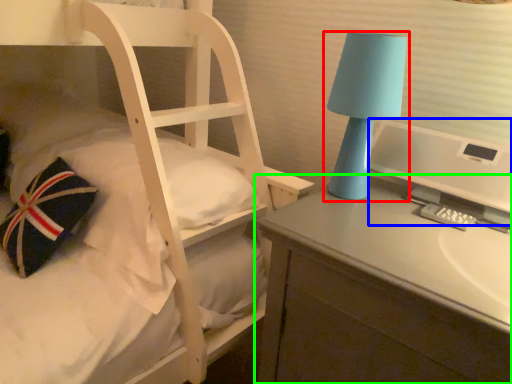
Question: Which object is positioned closest to lamp (highlighted by a red box)? Select from computer monitor (highlighted by a blue box) and desk (highlighted by a green box).

Choices:
 (A) computer monitor
 (B) desk

Answer: (A)